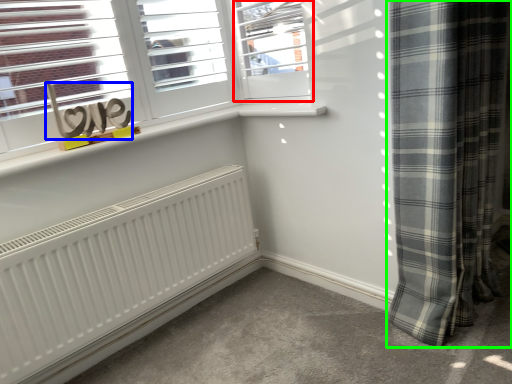
Question: Which is farther away from window (highlighted by a red box)? writing (highlighted by a blue box) or curtain (highlighted by a green box)?

Choices:
 (A) writing
 (B) curtain

Answer: (A)